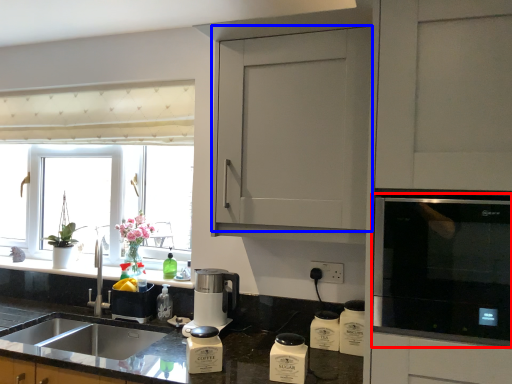
Question: Among these objects, which one is nearest to the camera, home appliance (highlighted by a red box) or cabinetry (highlighted by a blue box)?

Choices:
 (A) home appliance
 (B) cabinetry

Answer: (A)